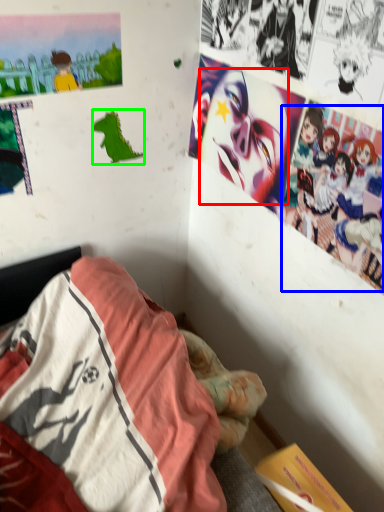
Question: Estimate the real-world distances between objects in this image. Which object is farther from human face (highlighted by a red box), person (highlighted by a blue box) or art (highlighted by a green box)?

Choices:
 (A) person
 (B) art

Answer: (B)